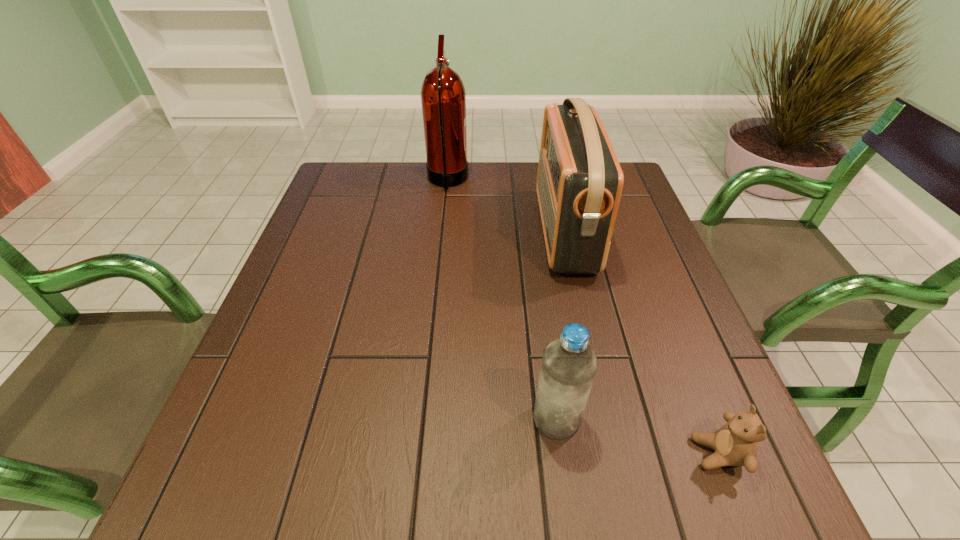
This screenshot has height=540, width=960. I want to click on vacant region located on the right of the second shortest object, so click(655, 419).

The height and width of the screenshot is (540, 960). In order to click on vacant area situated 0.370m on the front-facing side of the teddy bear in this screenshot , I will do 469,453.

Where is `free location located 0.300m on the front-facing side of the teddy bear`? This screenshot has height=540, width=960. free location located 0.300m on the front-facing side of the teddy bear is located at coordinates (513, 453).

In order to click on vacant area situated on the front-facing side of the teddy bear in this screenshot , I will do `click(524, 453)`.

You are a GUI agent. You are given a task and a screenshot of the screen. Output one action in this format:
    pyautogui.click(x=<x>, y=<y>)
    Task: Click on the fire extinguisher at the far edge
    
    Given the screenshot: What is the action you would take?
    pyautogui.click(x=443, y=97)

This screenshot has width=960, height=540. I want to click on radio receiver present at the far edge, so click(579, 184).

Find the location of a particular element. object at the near edge is located at coordinates (735, 444).

Image resolution: width=960 pixels, height=540 pixels. I want to click on object located at the right edge, so click(x=735, y=444).

This screenshot has width=960, height=540. In order to click on object that is at the near right corner in this screenshot , I will do `click(735, 444)`.

Locate an element on the screen. The height and width of the screenshot is (540, 960). vacant space at the far edge of the desktop is located at coordinates (391, 163).